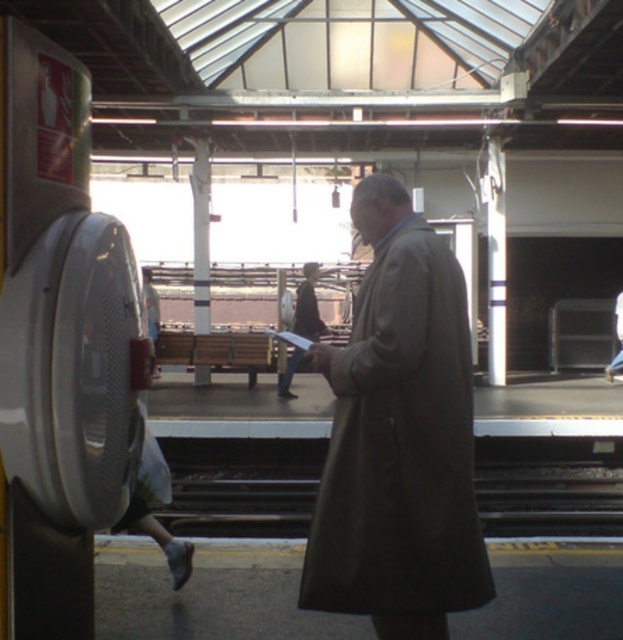
Question: Which object is positioned closest to the dark gray coat at center?

Choices:
 (A) brown matte trench coat at center
 (B) light brown leather coat at center

Answer: (B)

Question: Considering the real-world distances, which object is farthest from the dark gray metal train track at center?

Choices:
 (A) dark gray coat at center
 (B) brown matte trench coat at center

Answer: (B)

Question: Does brown matte trench coat at center lie in front of light brown leather coat at center?

Choices:
 (A) no
 (B) yes

Answer: (B)

Question: Does dark gray coat at center have a lesser width compared to light brown leather coat at center?

Choices:
 (A) yes
 (B) no

Answer: (B)

Question: Which of the following is the closest to the observer?

Choices:
 (A) (500, 506)
 (B) (316, 268)
 (C) (404, 250)
 (D) (616, 308)

Answer: (C)

Question: Is brown matte trench coat at center above dark gray metal train track at center?

Choices:
 (A) yes
 (B) no

Answer: (A)